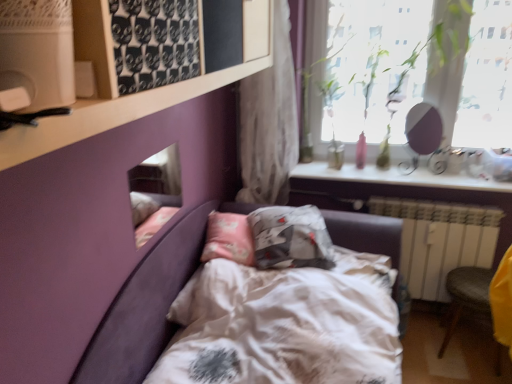
Question: In terms of size, does transparent glass window at upper right appear bigger or smaller than white glossy shelf at upper right?

Choices:
 (A) big
 (B) small

Answer: (A)

Question: Is transparent glass window at upper right spatially inside white glossy shelf at upper right, or outside of it?

Choices:
 (A) outside
 (B) inside

Answer: (A)

Question: Which is farther from the white matte shelf at upper left?

Choices:
 (A) white satin bed at center
 (B) white textured curtain at upper center
 (C) transparent glass window at upper right
 (D) matte purple mirror at upper right, which is counted as the first mirror, starting from the right
 (E) white glossy shelf at upper right

Answer: (D)

Question: Estimate the real-world distances between objects in this image. Which object is farther from the white painted metal radiator at lower right?

Choices:
 (A) transparent glass window at upper right
 (B) white matte shelf at upper left
 (C) white textured curtain at upper center
 (D) matte glass mirror at upper left, acting as the second mirror starting from the right
 (E) yellow fabric armchair at lower right

Answer: (B)